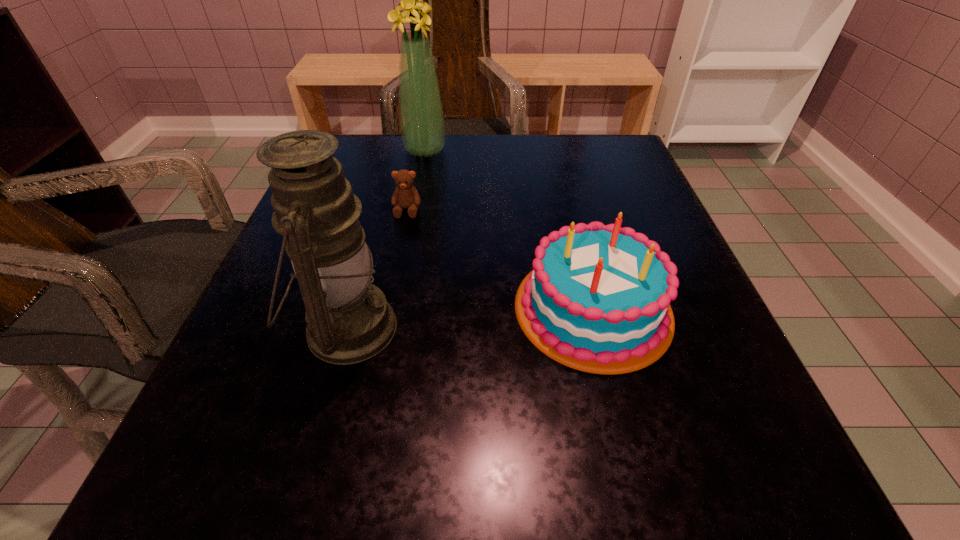
The height and width of the screenshot is (540, 960). In order to click on object situated at the far edge in this screenshot , I will do `click(422, 125)`.

Find the location of a particular element. Image resolution: width=960 pixels, height=540 pixels. object positioned at the left edge is located at coordinates (349, 320).

Find the location of `object that is at the right edge`. object that is at the right edge is located at coordinates (600, 299).

The width and height of the screenshot is (960, 540). I want to click on vacant space at the far edge of the desktop, so click(560, 174).

What are the coordinates of `free space at the near edge of the desktop` in the screenshot? It's located at (428, 503).

You are a GUI agent. You are given a task and a screenshot of the screen. Output one action in this format:
    pyautogui.click(x=<x>, y=<y>)
    Task: Click on the vacant space at the left edge
    The width and height of the screenshot is (960, 540).
    Given the screenshot: What is the action you would take?
    pyautogui.click(x=276, y=380)

You are a GUI agent. You are given a task and a screenshot of the screen. Output one action in this format:
    pyautogui.click(x=<x>, y=<y>)
    Task: Click on the vacant space at the right edge of the desktop
    The width and height of the screenshot is (960, 540).
    Given the screenshot: What is the action you would take?
    pyautogui.click(x=661, y=230)

The width and height of the screenshot is (960, 540). In order to click on free space at the far left corner in this screenshot , I will do `click(398, 146)`.

Identify the location of vacant region at the far right corner of the desktop. Image resolution: width=960 pixels, height=540 pixels. (587, 146).

Image resolution: width=960 pixels, height=540 pixels. What are the coordinates of `free spot between the teddy bear and the oil lamp` in the screenshot? It's located at (377, 269).